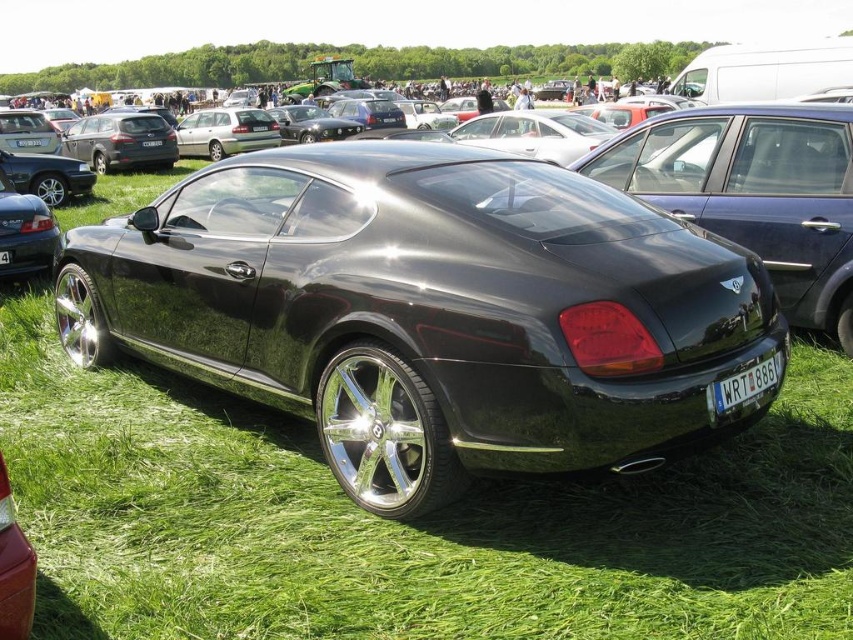
Question: Among these objects, which one is nearest to the camera?

Choices:
 (A) satin silver metallic station wagon at center
 (B) white plastic license plate at center
 (C) white plastic license plate at lower center
 (D) shiny black car at center

Answer: (D)

Question: Is white plastic license plate at lower center wider than white plastic license plate at center?

Choices:
 (A) yes
 (B) no

Answer: (A)

Question: Is satin silver metallic station wagon at center further to camera compared to white plastic license plate at lower center?

Choices:
 (A) yes
 (B) no

Answer: (A)

Question: Does white plastic license plate at lower center appear on the right side of white plastic license plate at center?

Choices:
 (A) no
 (B) yes

Answer: (B)

Question: Which object is closer to the camera taking this photo?

Choices:
 (A) white plastic license plate at lower center
 (B) shiny black car at center
 (C) white plastic license plate at center

Answer: (B)

Question: Which is nearer to the satin silver metallic station wagon at center?

Choices:
 (A) white plastic license plate at lower center
 (B) white plastic license plate at center
 (C) shiny black car at center

Answer: (B)